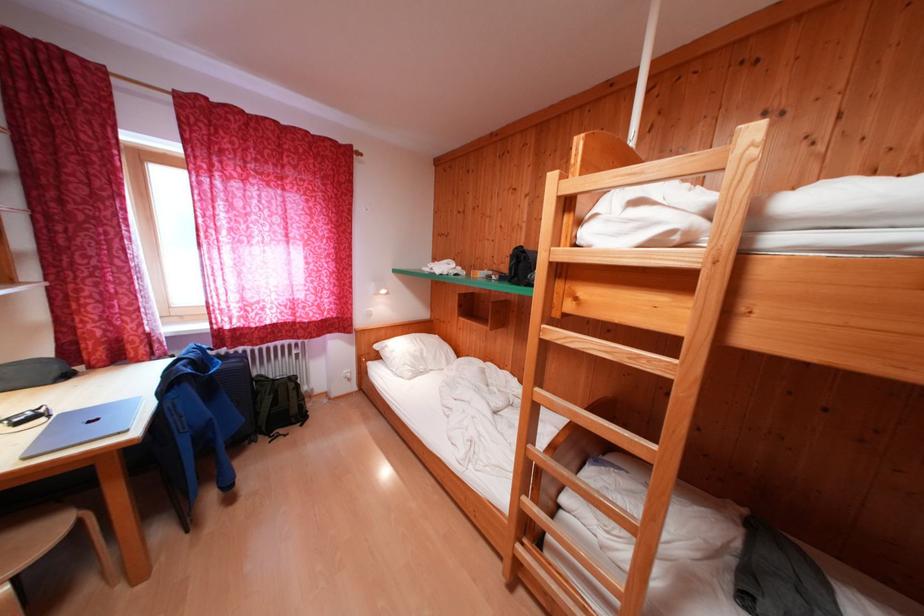
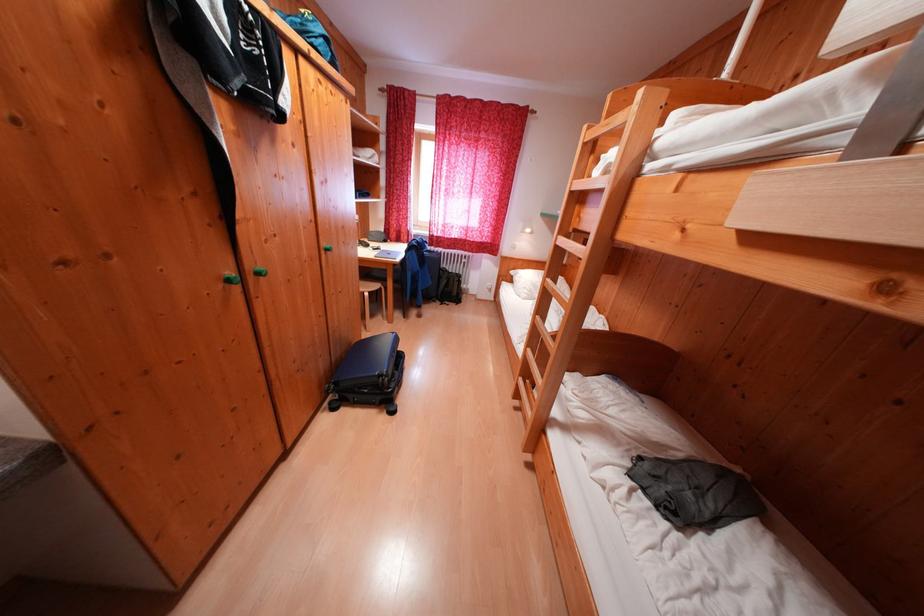
The point at (271, 383) is marked in the first image. Where is the corresponding point in the second image?

(454, 275)